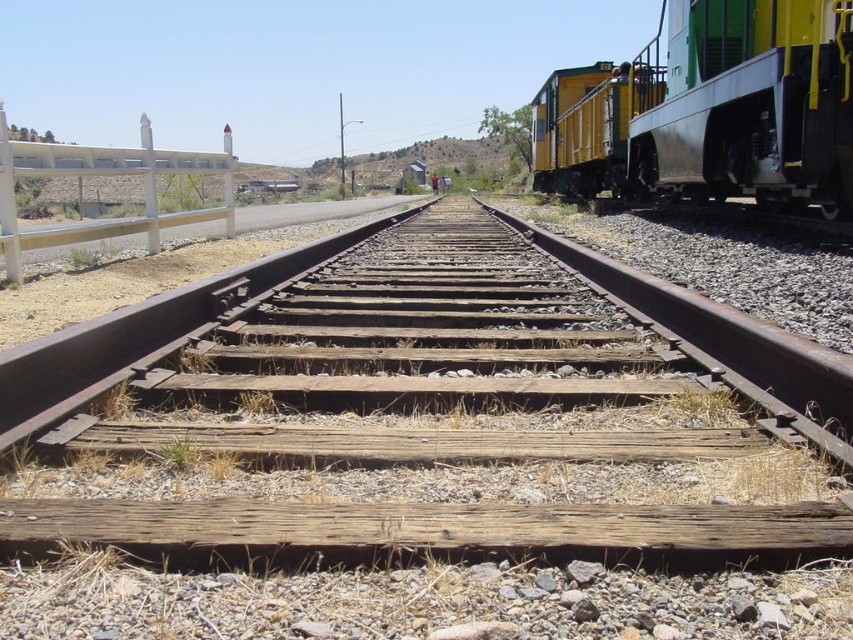
Does white concrete fence at left have a greater height compared to yellow matte train car at right?

No, white concrete fence at left is not taller than yellow matte train car at right.

Can you confirm if white concrete fence at left is positioned above yellow matte train car at right?

Actually, white concrete fence at left is below yellow matte train car at right.

Between point (68, 170) and point (625, 88), which one is positioned behind?

Positioned behind is point (625, 88).

Identify the location of white concrete fence at left. This screenshot has height=640, width=853. (103, 173).

Does point (654, 323) lie in front of point (642, 74)?

That is True.

Who is taller, wooden at center or yellow matte train car at right?

yellow matte train car at right

Looking at this image, who is more forward, (90, 444) or (595, 129)?

Point (90, 444) is more forward.

Identify the location of wooden at center. The image size is (853, 640). (425, 353).

Which is more to the left, wooden at center or green/yellow painted metal train car at right?

Positioned to the left is wooden at center.

Does wooden at center appear under green/yellow painted metal train car at right?

Yes, wooden at center is below green/yellow painted metal train car at right.

The width and height of the screenshot is (853, 640). I want to click on wooden at center, so [x=425, y=353].